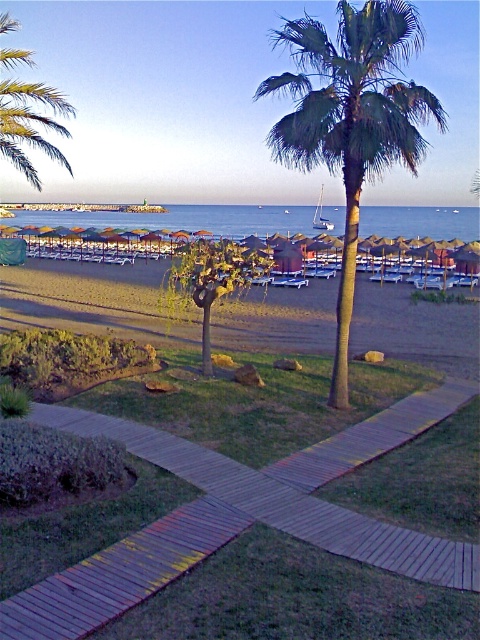
Describe the element at coordinates (351, 118) in the screenshot. The image size is (480, 640). I see `green leafy palm tree at center` at that location.

Locate an element on the screen. This screenshot has width=480, height=640. green leafy palm tree at center is located at coordinates (351, 118).

Does wooden at center have a greater height compared to beige sand beach at center?

Incorrect, wooden at center's height is not larger of beige sand beach at center's.

Is point (176, 545) behind point (116, 316)?

No, it is in front of (116, 316).

What are the coordinates of `wooden at center` in the screenshot? It's located at (240, 516).

Locate an element on the screen. wooden at center is located at coordinates (240, 516).

Is wooden at center wider than blue water at center?

In fact, wooden at center might be narrower than blue water at center.

Measure the distance from wooden at center to blue water at center.

A distance of 321.40 feet exists between wooden at center and blue water at center.

Between point (405, 568) and point (199, 214), which one is positioned in front?

Point (405, 568) is more forward.

Where is `wooden at center`? Image resolution: width=480 pixels, height=640 pixels. wooden at center is located at coordinates (240, 516).